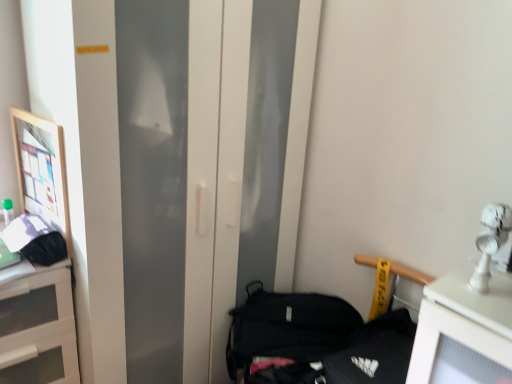
Where is `matte black handbag at left, marked as the first handbag in a left-to-right arrangement`? matte black handbag at left, marked as the first handbag in a left-to-right arrangement is located at coordinates (35, 240).

Find the location of `wooden framed picture at left`. wooden framed picture at left is located at coordinates (42, 170).

Which is behind, wooden framed picture at left or white matte cabinet at left?

wooden framed picture at left.

Is point (60, 156) in front of point (16, 338)?

Yes.

In the scene shown: Between wooden framed picture at left and white matte cabinet at left, which one appears on the left side from the viewer's perspective?

From the viewer's perspective, white matte cabinet at left appears more on the left side.

Is wooden framed picture at left situated inside white matte cabinet at left or outside?

wooden framed picture at left lies outside white matte cabinet at left.

Relative to matte black handbag at left, which is the 2th handbag from bottom to top, is white matte cabinet at left in front or behind?

white matte cabinet at left is positioned closer to the viewer than matte black handbag at left, which is the 2th handbag from bottom to top.

Is white matte cabinet at left oriented towards matte black handbag at left, the 1th handbag viewed from the top?

No, white matte cabinet at left is not facing towards matte black handbag at left, the 1th handbag viewed from the top.

In terms of width, does white matte cabinet at left look wider or thinner when compared to matte black handbag at left, marked as the first handbag in a left-to-right arrangement?

In the image, white matte cabinet at left appears to be wider than matte black handbag at left, marked as the first handbag in a left-to-right arrangement.

Where is `cabinetry located underneath the matte black handbag at left, the 1th handbag viewed from the top (from a real-world perspective)`? The image size is (512, 384). cabinetry located underneath the matte black handbag at left, the 1th handbag viewed from the top (from a real-world perspective) is located at coordinates (38, 328).

Which of these two, matte black handbag at left, which is the 2th handbag from bottom to top, or black fabric handbag at lower right, which is the 2th handbag from left to right, is bigger?

With larger size is black fabric handbag at lower right, which is the 2th handbag from left to right.

What's the angular difference between matte black handbag at left, marked as the first handbag in a left-to-right arrangement, and black fabric handbag at lower right, the first handbag from the bottom,'s facing directions?

93.7 degrees separate the facing orientations of matte black handbag at left, marked as the first handbag in a left-to-right arrangement, and black fabric handbag at lower right, the first handbag from the bottom.

From the image's perspective, is matte black handbag at left, marked as the first handbag in a left-to-right arrangement, over black fabric handbag at lower right, the first handbag from the bottom?

Correct, matte black handbag at left, marked as the first handbag in a left-to-right arrangement, appears higher than black fabric handbag at lower right, the first handbag from the bottom, in the image.

Does matte black handbag at left, marked as the first handbag in a left-to-right arrangement, appear on the left side of black fabric handbag at lower right, which is the 2th handbag from left to right?

Correct, you'll find matte black handbag at left, marked as the first handbag in a left-to-right arrangement, to the left of black fabric handbag at lower right, which is the 2th handbag from left to right.

Between matte black handbag at left, the 1th handbag viewed from the top, and wooden framed picture at left, which one has larger width?

matte black handbag at left, the 1th handbag viewed from the top, is wider.

Is matte black handbag at left, marked as the first handbag in a left-to-right arrangement, in contact with wooden framed picture at left?

They are not placed beside each other.

Is matte black handbag at left, the 1th handbag viewed from the top, situated inside wooden framed picture at left or outside?

matte black handbag at left, the 1th handbag viewed from the top, is spatially situated outside wooden framed picture at left.

From the image's perspective, between matte black handbag at left, which is the 2th handbag from bottom to top, and wooden framed picture at left, who is located below?

matte black handbag at left, which is the 2th handbag from bottom to top, from the image's perspective.

Can you tell me how much black fabric handbag at lower right, the first handbag from the right, and white matte cabinet at left differ in facing direction?

There is a 91.9-degree angle between the facing directions of black fabric handbag at lower right, the first handbag from the right, and white matte cabinet at left.

Is black fabric handbag at lower right, the first handbag from the right, further to the viewer compared to white matte cabinet at left?

Yes.

Is black fabric handbag at lower right, which is the 2th handbag from left to right, positioned with its back to white matte cabinet at left?

black fabric handbag at lower right, which is the 2th handbag from left to right, does not have its back to white matte cabinet at left.

The width and height of the screenshot is (512, 384). I want to click on cabinetry below the black fabric handbag at lower right, which is the 2th handbag from left to right (from the image's perspective), so click(x=38, y=328).

Is wooden framed picture at left to the left or to the right of matte black handbag at left, the 1th handbag viewed from the top, in the image?

wooden framed picture at left is positioned on matte black handbag at left, the 1th handbag viewed from the top,'s left side.

Does wooden framed picture at left have a lesser height compared to matte black handbag at left, the 1th handbag viewed from the top?

No.

Is wooden framed picture at left behind matte black handbag at left, marked as the first handbag in a left-to-right arrangement?

Yes, it is.

Is wooden framed picture at left smaller than matte black handbag at left, the 1th handbag viewed from the top?

No.

Can you tell me how much black fabric handbag at lower right, the first handbag from the right, and matte black handbag at left, the 1th handbag viewed from the top, differ in facing direction?

There is a 93.7-degree angle between the facing directions of black fabric handbag at lower right, the first handbag from the right, and matte black handbag at left, the 1th handbag viewed from the top.

Considering the relative sizes of black fabric handbag at lower right, the first handbag from the bottom, and matte black handbag at left, which is the 2th handbag from bottom to top, in the image provided, is black fabric handbag at lower right, the first handbag from the bottom, taller than matte black handbag at left, which is the 2th handbag from bottom to top,?

Yes.

Does black fabric handbag at lower right, the second handbag in the top-to-bottom sequence, have a lesser width compared to matte black handbag at left, which is the second handbag in right-to-left order?

No.

In the image, there is a white matte cabinet at left. Identify the location of picture frame above it (from the image's perspective). (42, 170).

Locate an element on the screen. Image resolution: width=512 pixels, height=384 pixels. handbag that is the 1st object to the right of the white matte cabinet at left, starting at the anchor is located at coordinates (35, 240).

Looking at the image, which one is located further to matte black handbag at left, marked as the first handbag in a left-to-right arrangement, black fabric handbag at lower right, the first handbag from the right, or white matte cabinet at left?

black fabric handbag at lower right, the first handbag from the right.

Considering their positions, is white matte cabinet at left positioned closer to matte black handbag at left, which is the 2th handbag from bottom to top, than wooden framed picture at left?

wooden framed picture at left is positioned closer to the anchor matte black handbag at left, which is the 2th handbag from bottom to top.

Consider the image. Based on their spatial positions, is white matte cabinet at left or black fabric handbag at lower right, the second handbag in the top-to-bottom sequence, closer to wooden framed picture at left?

white matte cabinet at left is positioned closer to the anchor wooden framed picture at left.

Estimate the real-world distances between objects in this image. Which object is closer to matte black handbag at left, which is the second handbag in right-to-left order, wooden framed picture at left or white matte cabinet at left?

wooden framed picture at left is positioned closer to the anchor matte black handbag at left, which is the second handbag in right-to-left order.

Looking at the image, which one is located closer to black fabric handbag at lower right, the first handbag from the bottom, matte black handbag at left, which is the 2th handbag from bottom to top, or wooden framed picture at left?

Among the two, matte black handbag at left, which is the 2th handbag from bottom to top, is located nearer to black fabric handbag at lower right, the first handbag from the bottom.

Which object lies nearer to the anchor point white matte cabinet at left, matte black handbag at left, which is the 2th handbag from bottom to top, or wooden framed picture at left?

matte black handbag at left, which is the 2th handbag from bottom to top, is closer to white matte cabinet at left.

Based on their spatial positions, is matte black handbag at left, which is the second handbag in right-to-left order, or black fabric handbag at lower right, which is the 2th handbag from left to right, further from wooden framed picture at left?

The object further to wooden framed picture at left is black fabric handbag at lower right, which is the 2th handbag from left to right.

In the scene shown: Estimate the real-world distances between objects in this image. Which object is closer to black fabric handbag at lower right, the first handbag from the right, matte black handbag at left, which is the second handbag in right-to-left order, or white matte cabinet at left?

white matte cabinet at left.

This screenshot has width=512, height=384. I want to click on handbag between white matte cabinet at left and black fabric handbag at lower right, which is the 2th handbag from left to right, from left to right, so click(x=35, y=240).

This screenshot has height=384, width=512. Identify the location of picture frame between white matte cabinet at left and black fabric handbag at lower right, the second handbag in the top-to-bottom sequence, from left to right. (42, 170).

Find the location of a particular element. The height and width of the screenshot is (384, 512). handbag between wooden framed picture at left and black fabric handbag at lower right, the first handbag from the bottom is located at coordinates [x=35, y=240].